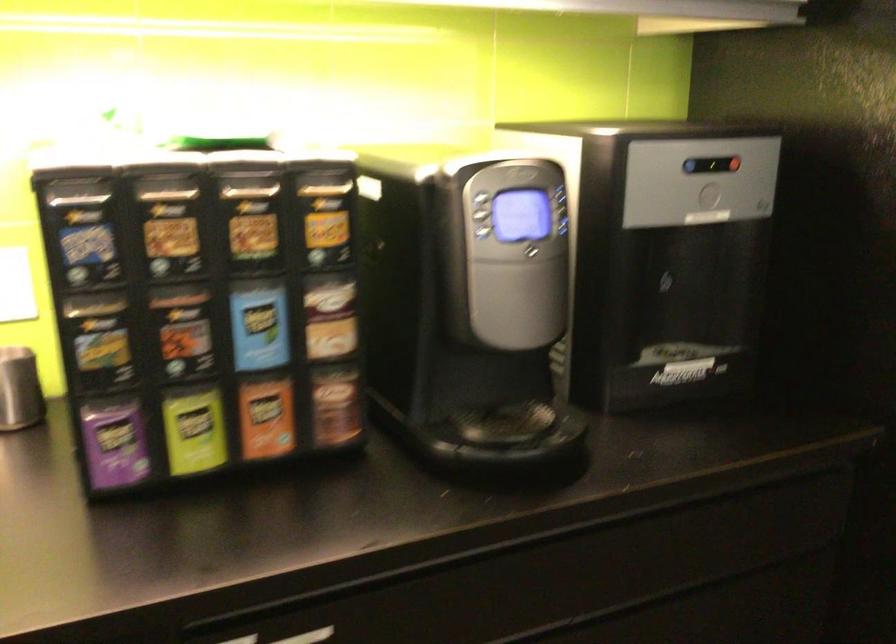
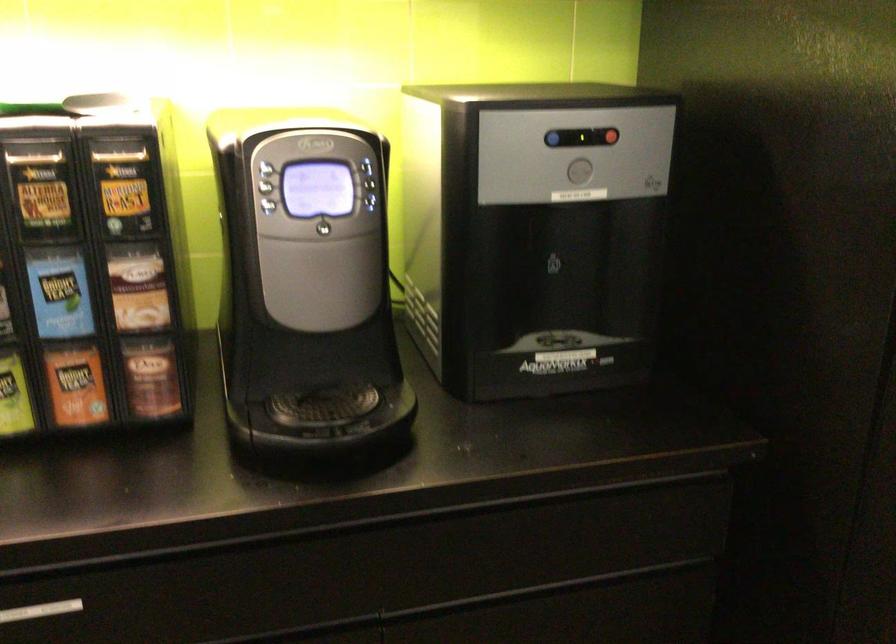
Locate, in the second image, the point that corresponds to (250,225) in the first image.

(41, 191)